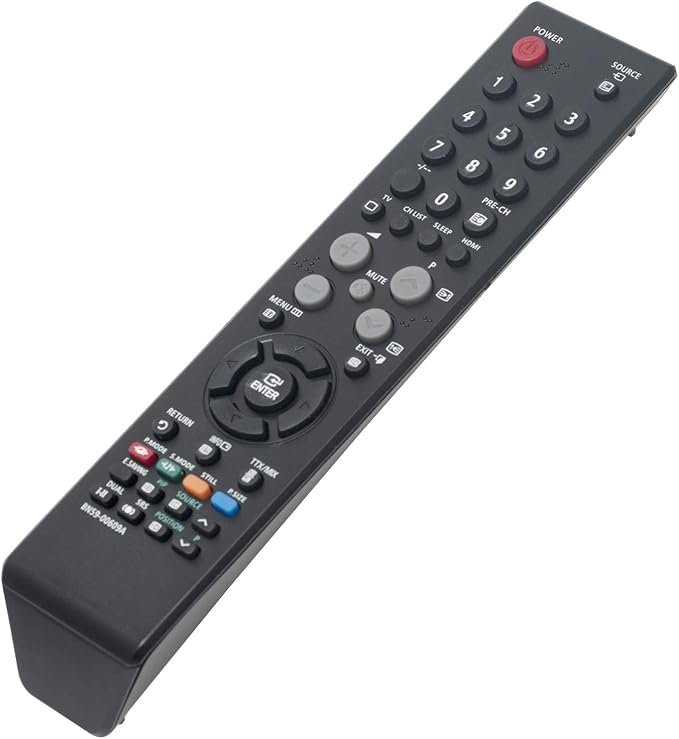
Where is `tv remote number buttons`? Image resolution: width=679 pixels, height=739 pixels. tv remote number buttons is located at coordinates (443, 204), (473, 168), (498, 134), (532, 103), (572, 115), (545, 149), (512, 183), (441, 143), (469, 115), (493, 85).